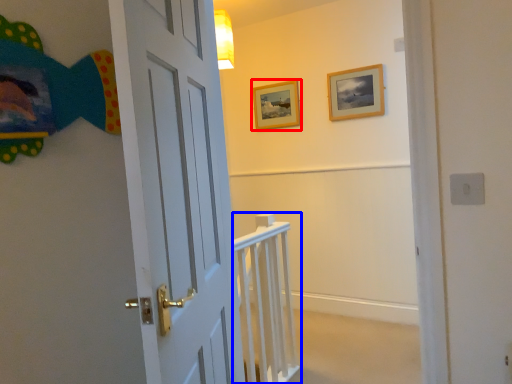
Question: Which point is closer to the camera, picture frame (highlighted by a red box) or rail (highlighted by a blue box)?

Choices:
 (A) picture frame
 (B) rail

Answer: (B)